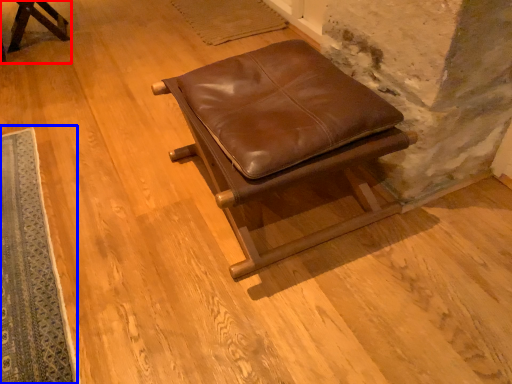
Question: Which of the following is the farthest to the observer, furniture (highlighted by a red box) or mat (highlighted by a blue box)?

Choices:
 (A) furniture
 (B) mat

Answer: (A)